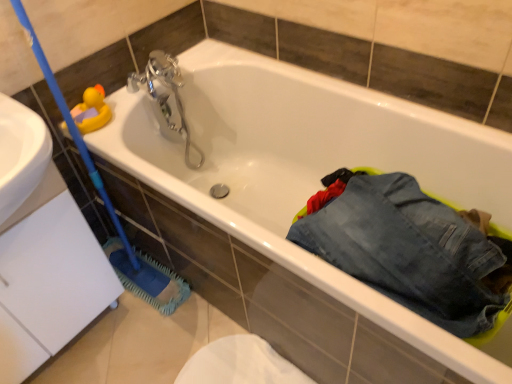
In the scene shown: What is the approximate height of rubber duck at upper left?

It is 10.24 centimeters.

Describe the element at coordinates (409, 248) in the screenshot. I see `denim pants at lower right` at that location.

At what (x,y) coordinates should I click in order to perform the action: click on silver metallic faucet at upper center. Please return your answer as a coordinate pair (x, y). The image size is (512, 384). Looking at the image, I should click on (166, 96).

The width and height of the screenshot is (512, 384). What are the coordinates of `rubber duck at upper left` in the screenshot? It's located at (91, 110).

Looking at this image, is rubber duck at upper left completely or partially outside of denim pants at lower right?

Yes, rubber duck at upper left is outside of denim pants at lower right.

Is rubber duck at upper left facing towards denim pants at lower right?

Yes.

Does rubber duck at upper left have a smaller size compared to denim pants at lower right?

Yes.

Is silver metallic faucet at upper center taller than blue rubber brush at left?

No, silver metallic faucet at upper center is not taller than blue rubber brush at left.

From the image's perspective, who appears lower, silver metallic faucet at upper center or blue rubber brush at left?

blue rubber brush at left appears lower in the image.

Is silver metallic faucet at upper center in front of or behind blue rubber brush at left in the image?

silver metallic faucet at upper center is behind blue rubber brush at left.

Is silver metallic faucet at upper center beside blue rubber brush at left?

No, silver metallic faucet at upper center is not in contact with blue rubber brush at left.

Measure the distance between blue rubber brush at left and rubber duck at upper left.

The distance of blue rubber brush at left from rubber duck at upper left is 8.21 inches.

Is blue rubber brush at left facing towards rubber duck at upper left?

No, blue rubber brush at left is not facing towards rubber duck at upper left.

Considering the points (151, 281) and (83, 113), which point is behind, point (151, 281) or point (83, 113)?

The point (151, 281) is farther from the camera.

From a real-world perspective, relative to rubber duck at upper left, is blue rubber brush at left vertically above or below?

From a real-world perspective, blue rubber brush at left is physically below rubber duck at upper left.

Is rubber duck at upper left positioned with its back to silver metallic faucet at upper center?

That's not correct — rubber duck at upper left is not looking away from silver metallic faucet at upper center.

Based on the photo, are rubber duck at upper left and silver metallic faucet at upper center located far from each other?

No, rubber duck at upper left is not far away from silver metallic faucet at upper center.

Could silver metallic faucet at upper center be considered to be inside rubber duck at upper left?

No, silver metallic faucet at upper center is located outside of rubber duck at upper left.

Is rubber duck at upper left closer to camera compared to silver metallic faucet at upper center?

Yes, rubber duck at upper left is closer to the camera.

Considering the positions of point (414, 276) and point (147, 86), is point (414, 276) closer or farther from the camera than point (147, 86)?

Point (414, 276).

In the scene shown: Considering the relative positions of denim pants at lower right and silver metallic faucet at upper center in the image provided, is denim pants at lower right to the right of silver metallic faucet at upper center from the viewer's perspective?

Indeed, denim pants at lower right is positioned on the right side of silver metallic faucet at upper center.

What's the angular difference between denim pants at lower right and silver metallic faucet at upper center's facing directions?

90 degrees.

What's the angular difference between blue rubber brush at left and denim pants at lower right's facing directions?

There is a 90-degree angle between the facing directions of blue rubber brush at left and denim pants at lower right.

Is blue rubber brush at left positioned beyond the bounds of denim pants at lower right?

Absolutely, blue rubber brush at left is external to denim pants at lower right.

From the image's perspective, is blue rubber brush at left on denim pants at lower right?

Indeed, from the image's perspective, blue rubber brush at left is shown above denim pants at lower right.

Between blue rubber brush at left and denim pants at lower right, which one appears on the left side from the viewer's perspective?

blue rubber brush at left is more to the left.

Identify the location of toy behind the blue rubber brush at left. (91, 110).

Is blue rubber brush at left surrounded by rubber duck at upper left?

Definitely not — blue rubber brush at left is not inside rubber duck at upper left.

Looking at this image, considering the sizes of objects rubber duck at upper left and blue rubber brush at left in the image provided, who is bigger, rubber duck at upper left or blue rubber brush at left?

With larger size is blue rubber brush at left.

In the image, there is a rubber duck at upper left. Identify the location of trousers below it (from the image's perspective). The image size is (512, 384). (409, 248).

Find the location of a particular element. The image size is (512, 384). brush located above the silver metallic faucet at upper center (from a real-world perspective) is located at coordinates (106, 191).

Which object lies nearer to the anchor point blue rubber brush at left, silver metallic faucet at upper center or rubber duck at upper left?

rubber duck at upper left is closer to blue rubber brush at left.

From the image, which object appears to be farther from blue rubber brush at left, silver metallic faucet at upper center or denim pants at lower right?

Among the two, denim pants at lower right is located further to blue rubber brush at left.

Looking at the image, which one is located further to silver metallic faucet at upper center, denim pants at lower right or rubber duck at upper left?

Based on the image, denim pants at lower right appears to be further to silver metallic faucet at upper center.

Estimate the real-world distances between objects in this image. Which object is further from blue rubber brush at left, denim pants at lower right or silver metallic faucet at upper center?

denim pants at lower right.

Which object lies nearer to the anchor point rubber duck at upper left, denim pants at lower right or blue rubber brush at left?

Among the two, blue rubber brush at left is located nearer to rubber duck at upper left.

When comparing their distances from silver metallic faucet at upper center, does rubber duck at upper left or denim pants at lower right seem closer?

rubber duck at upper left is positioned closer to the anchor silver metallic faucet at upper center.

When comparing their distances from denim pants at lower right, does rubber duck at upper left or silver metallic faucet at upper center seem further?

Based on the image, rubber duck at upper left appears to be further to denim pants at lower right.

When comparing their distances from blue rubber brush at left, does rubber duck at upper left or silver metallic faucet at upper center seem further?

Among the two, silver metallic faucet at upper center is located further to blue rubber brush at left.

Locate an element on the screen. Image resolution: width=512 pixels, height=384 pixels. toy between blue rubber brush at left and silver metallic faucet at upper center from front to back is located at coordinates (91, 110).

The width and height of the screenshot is (512, 384). Identify the location of tap between blue rubber brush at left and denim pants at lower right from left to right. (166, 96).

Find the location of `brush located between rubber duck at upper left and denim pants at lower right in the left-right direction`. brush located between rubber duck at upper left and denim pants at lower right in the left-right direction is located at coordinates (106, 191).

At what (x,y) coordinates should I click in order to perform the action: click on tap between rubber duck at upper left and denim pants at lower right. Please return your answer as a coordinate pair (x, y). This screenshot has width=512, height=384. Looking at the image, I should click on (166, 96).